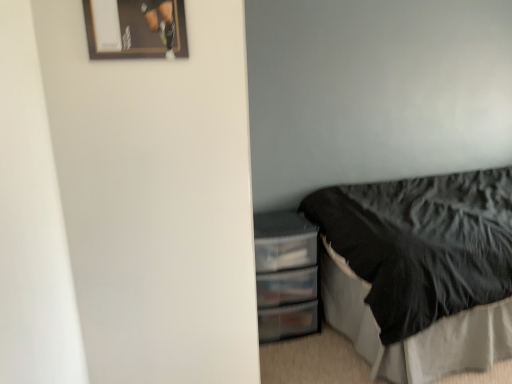
Question: Does point (157, 34) appear closer or farther from the camera than point (386, 244)?

Choices:
 (A) farther
 (B) closer

Answer: (B)

Question: Considering the positions of wooden framed poster at upper left and black feathered bed at lower right in the image, is wooden framed poster at upper left wider or thinner than black feathered bed at lower right?

Choices:
 (A) thin
 (B) wide

Answer: (A)

Question: Which is farther from the transparent plastic drawers at lower right?

Choices:
 (A) black feathered bed at lower right
 (B) wooden framed poster at upper left

Answer: (B)

Question: Which is nearer to the wooden framed poster at upper left?

Choices:
 (A) black feathered bed at lower right
 (B) transparent plastic drawers at lower right

Answer: (B)